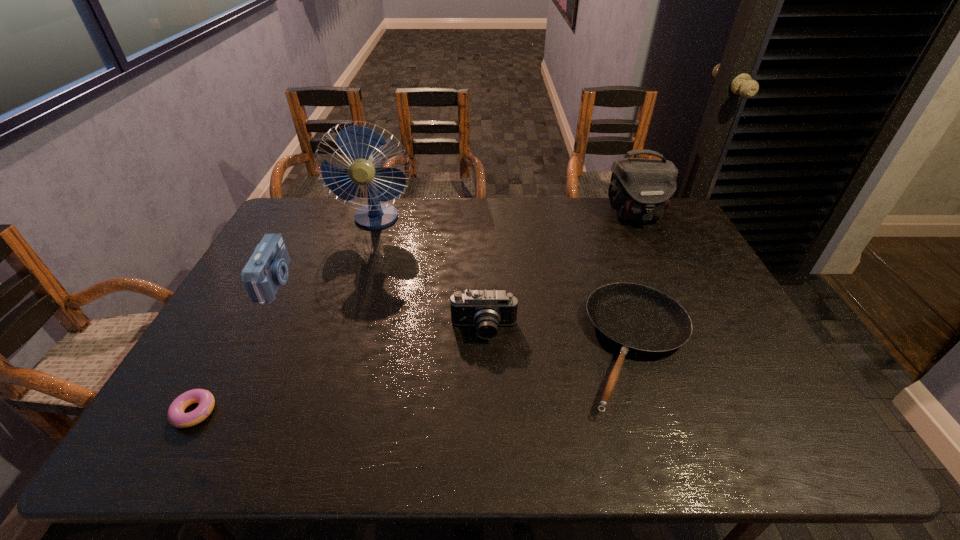
Find the location of a particular element. The width and height of the screenshot is (960, 540). the fourth object from right to left is located at coordinates (357, 142).

The height and width of the screenshot is (540, 960). In order to click on fan in this screenshot , I will do `click(357, 142)`.

I want to click on the fifth shortest object, so click(x=641, y=189).

Where is `the farther camera`? The image size is (960, 540). the farther camera is located at coordinates (267, 269).

Locate an element on the screen. This screenshot has height=540, width=960. the nearer camera is located at coordinates (486, 309).

The image size is (960, 540). Find the location of `the right camera`. the right camera is located at coordinates (486, 309).

Find the location of a particular element. The image size is (960, 540). the second shortest object is located at coordinates (639, 319).

Where is `doughnut`? The width and height of the screenshot is (960, 540). doughnut is located at coordinates (175, 414).

This screenshot has width=960, height=540. What are the coordinates of `vacant point located 0.260m at the front of the tallest object where the blades are visible` in the screenshot? It's located at (355, 284).

This screenshot has height=540, width=960. In order to click on free point located on the open flap of the shoulder bag in this screenshot , I will do `click(652, 249)`.